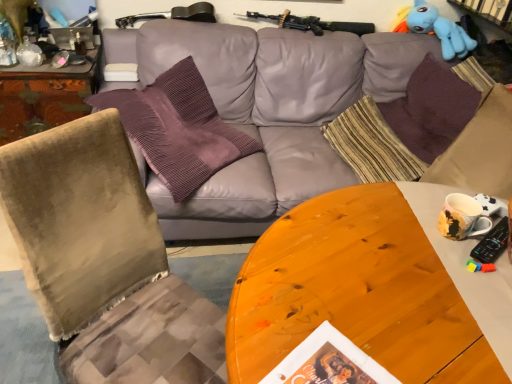
Question: From the image's perspective, is wooden desk at left on white matte magazine at center?

Choices:
 (A) yes
 (B) no

Answer: (B)

Question: Does wooden desk at left have a smaller size compared to white matte magazine at center?

Choices:
 (A) no
 (B) yes

Answer: (A)

Question: Can you confirm if wooden desk at left is taller than white matte magazine at center?

Choices:
 (A) yes
 (B) no

Answer: (A)

Question: From a real-world perspective, is wooden desk at left physically below white matte magazine at center?

Choices:
 (A) no
 (B) yes

Answer: (B)

Question: Is wooden desk at left not near white matte magazine at center?

Choices:
 (A) no
 (B) yes

Answer: (A)

Question: Are wooden desk at left and white matte magazine at center making contact?

Choices:
 (A) no
 (B) yes

Answer: (A)

Question: Is purple velvet pillow at upper left, the 4th pillow from the right, taller than gray leather couch at center?

Choices:
 (A) no
 (B) yes

Answer: (B)

Question: From the image's perspective, would you say purple velvet pillow at upper left, the 4th pillow from the right, is positioned over gray leather couch at center?

Choices:
 (A) no
 (B) yes

Answer: (A)

Question: Is purple velvet pillow at upper left, the 4th pillow from the right, touching gray leather couch at center?

Choices:
 (A) no
 (B) yes

Answer: (A)

Question: Is purple velvet pillow at upper left, the 4th pillow from the right, closer to the viewer compared to gray leather couch at center?

Choices:
 (A) no
 (B) yes

Answer: (B)

Question: Is purple velvet pillow at upper left, the 4th pillow from the right, facing away from gray leather couch at center?

Choices:
 (A) yes
 (B) no

Answer: (A)

Question: Can you confirm if purple velvet pillow at upper left, which is the first pillow from left to right, is wider than gray leather couch at center?

Choices:
 (A) no
 (B) yes

Answer: (A)

Question: From the image's perspective, is gray leather couch at center beneath wooden desk at left?

Choices:
 (A) yes
 (B) no

Answer: (A)